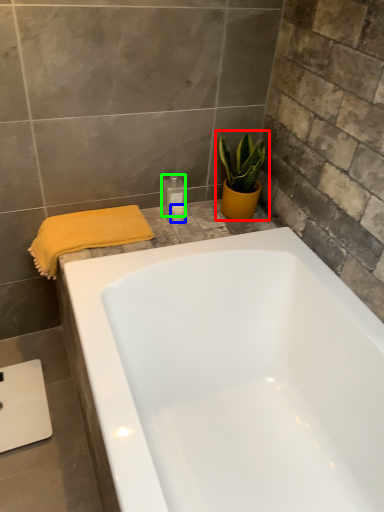
Question: Based on their relative distances, which object is farther from houseplant (highlighted by a red box)? Choose from toiletry (highlighted by a blue box) and toiletry (highlighted by a green box).

Choices:
 (A) toiletry
 (B) toiletry

Answer: (A)